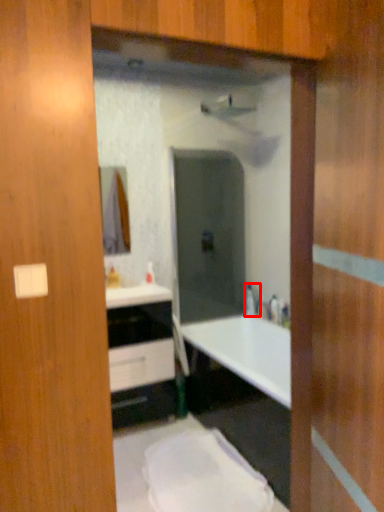
Question: From the image's perspective, where is faucet (annotated by the red box) located relative to bathroom cabinet?

Choices:
 (A) below
 (B) above

Answer: (B)